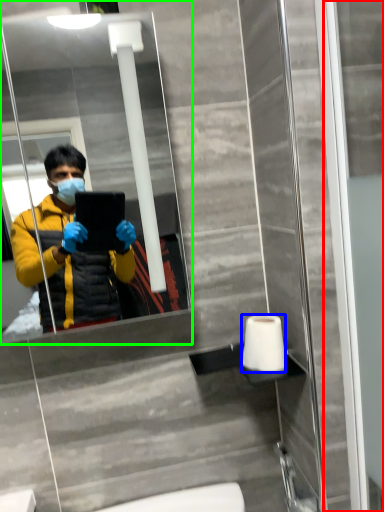
Question: Which is nearer to the screen door (highlighted by a red box)? toilet paper (highlighted by a blue box) or mirror (highlighted by a green box).

Choices:
 (A) toilet paper
 (B) mirror

Answer: (A)